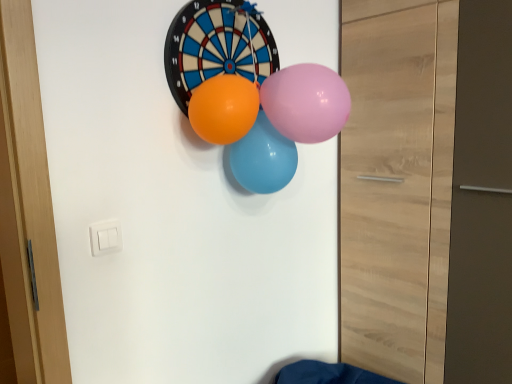
Question: Looking at the image, does pink glossy balloon at center, the third balloon in the back-to-front sequence, seem bigger or smaller compared to orange rubber balloon at center, which is counted as the second balloon, starting from the front?

Choices:
 (A) small
 (B) big

Answer: (B)

Question: Considering the relative positions of pink glossy balloon at center, the third balloon in the back-to-front sequence, and orange rubber balloon at center, the 2th balloon viewed from the back, in the image provided, is pink glossy balloon at center, the third balloon in the back-to-front sequence, to the left or to the right of orange rubber balloon at center, the 2th balloon viewed from the back,?

Choices:
 (A) right
 (B) left

Answer: (A)

Question: Based on their relative distances, which object is nearer to the matte blue balloon at center, acting as the 3th balloon starting from the front?

Choices:
 (A) pink glossy balloon at center, the 1th balloon in the front-to-back sequence
 (B) orange rubber balloon at center, the 2th balloon viewed from the back

Answer: (B)

Question: Estimate the real-world distances between objects in this image. Which object is farther from the orange rubber balloon at center, which is counted as the second balloon, starting from the front?

Choices:
 (A) matte blue balloon at center, acting as the 3th balloon starting from the front
 (B) pink glossy balloon at center, the third balloon in the back-to-front sequence

Answer: (B)